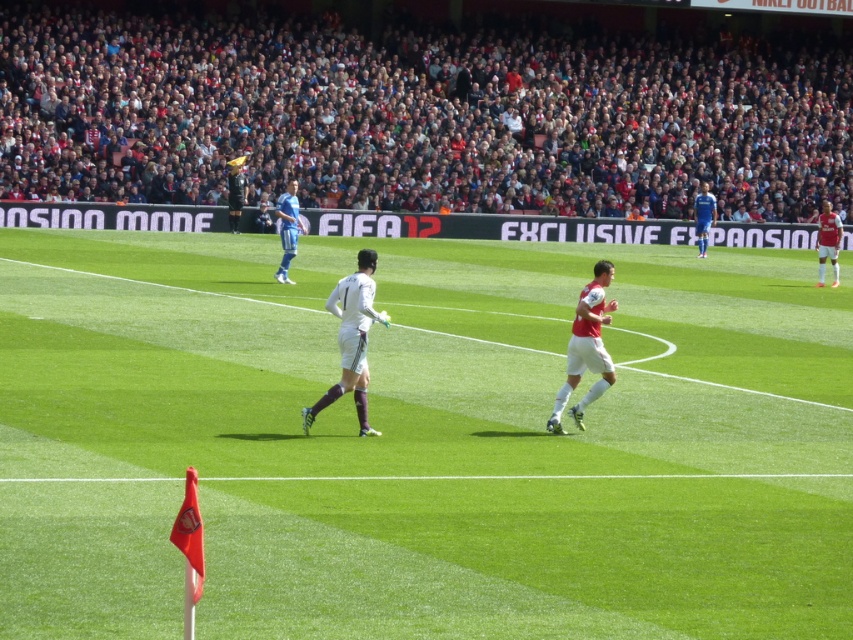
You are a photographer positioned at the edge of the soccer field. You want to capture a photo that includes both the blue jersey at right and the black jersey at upper center. Which jersey should you focus on first to ensure it takes up more of the frame?

The black jersey at upper center occupies more space than the blue jersey at right, so you should focus on the black jersey at upper center first to ensure it takes up more of the frame.